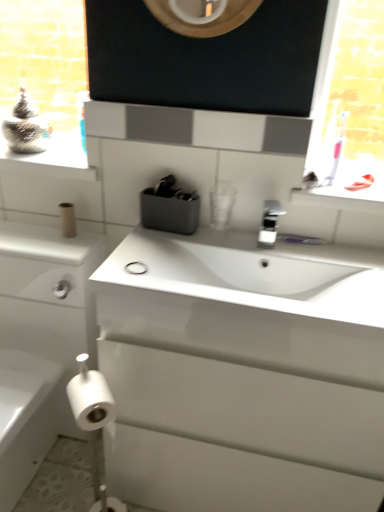
Locate an element on the screen. Image resolution: width=384 pixels, height=512 pixels. empty space that is ontop of white glossy sink at center (from a real-world perspective) is located at coordinates (248, 254).